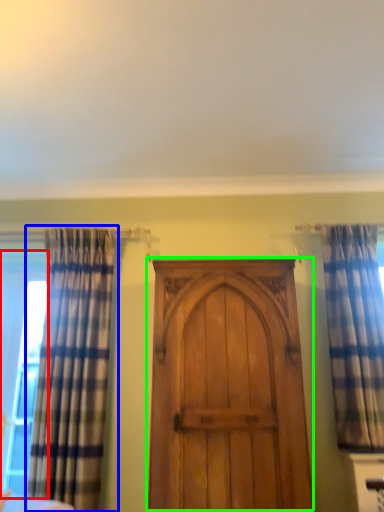
Question: Considering the real-world distances, which object is farthest from window (highlighted by a red box)? curtain (highlighted by a blue box) or door (highlighted by a green box)?

Choices:
 (A) curtain
 (B) door

Answer: (B)